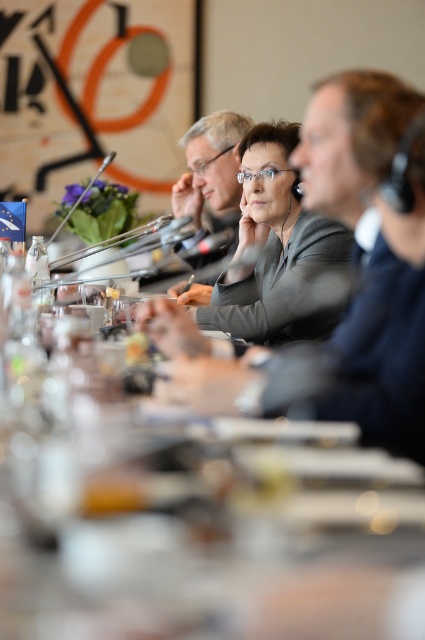
You are a server at the conference and need to place a new set of coasters under the clear plastic cups at center and the matte gray suit at center. Which object requires a larger coaster based on their height?

The matte gray suit at center requires a larger coaster because it is taller than the clear plastic cups at center.

You are a conference attendee who just entered the room and need to grab a drink. The clear plastic cups at center are located at coordinates 0.808, 0.456. Can you reach them without moving past the table?

The clear plastic cups at center are located at coordinates (193, 516), which are on the table. Since you are standing at the table, you can easily reach them without moving past the table.

You are a photographer positioned behind the long table in the conference room. You need to capture a closeup shot of both the matte gray suit at center and the matte black glasses at center without any obstruction. Given their positions and sizes, is it possible to frame both in the same shot without one blocking the other?

The matte gray suit at center might be wider than matte black glasses at center, so there is a possibility that the wider matte gray suit at center could block the matte black glasses at center in the frame. Adjust the camera angle or position to ensure both are visible without overlap.